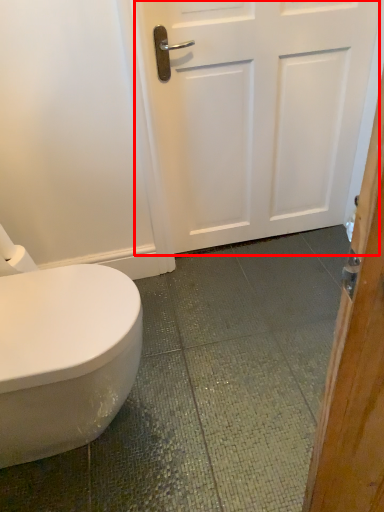
Question: From the image's perspective, where is door (annotated by the red box) located in relation to toilet paper in the image?

Choices:
 (A) below
 (B) above

Answer: (B)